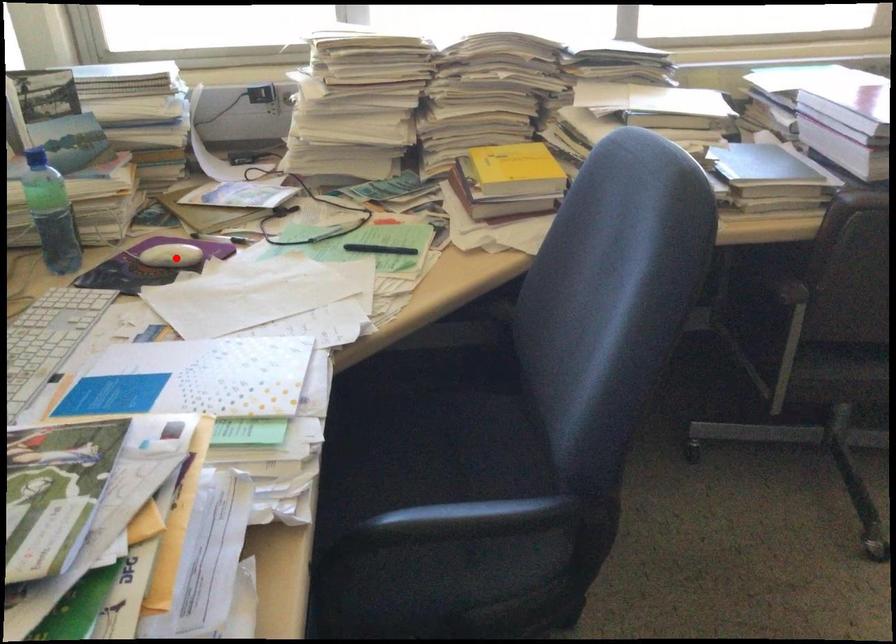
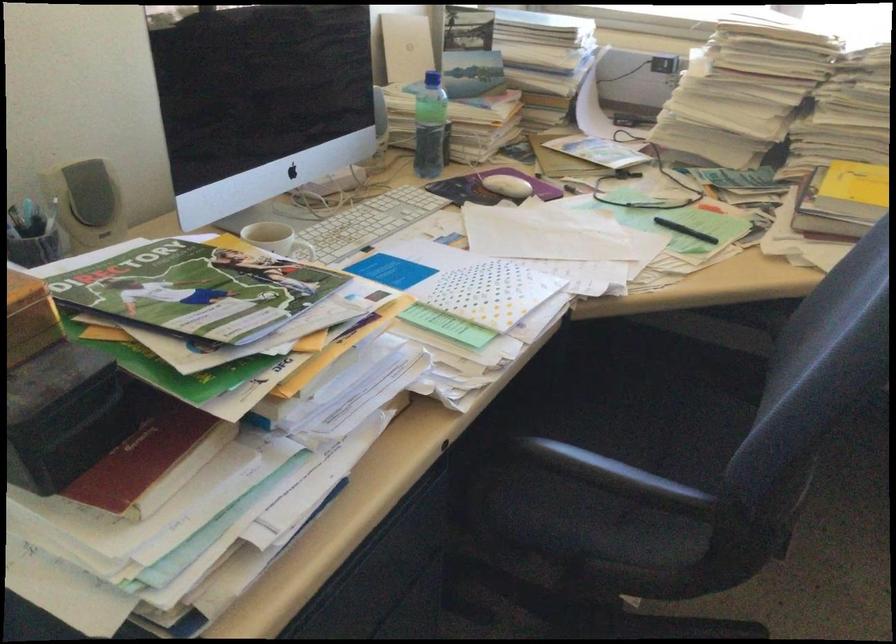
Find the pixel in the second image that matches the highlighted location in the first image.

(506, 185)